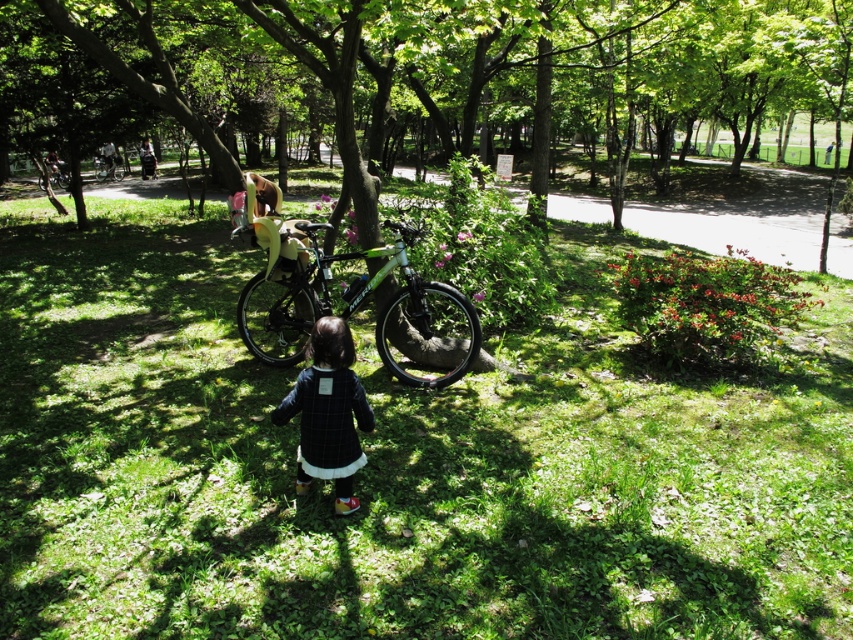
Question: Which object appears farthest from the camera in this image?

Choices:
 (A) green matte bicycle at center
 (B) green matte bicycle at upper center

Answer: (B)

Question: Is dark blue wool dress at center below green matte bicycle at upper center?

Choices:
 (A) yes
 (B) no

Answer: (A)

Question: Which of the following is the farthest from the observer?

Choices:
 (A) green matte tree at center
 (B) green matte bicycle at upper left
 (C) dark blue wool dress at center
 (D) green grass at center

Answer: (B)

Question: Does green matte tree at center appear on the right side of green matte bicycle at upper left?

Choices:
 (A) yes
 (B) no

Answer: (A)

Question: Does green grass at center have a larger size compared to green matte tree at center?

Choices:
 (A) no
 (B) yes

Answer: (A)

Question: Which is farther from the green matte tree at center?

Choices:
 (A) green matte bicycle at center
 (B) green matte bicycle at upper left
 (C) dark blue wool dress at center

Answer: (B)